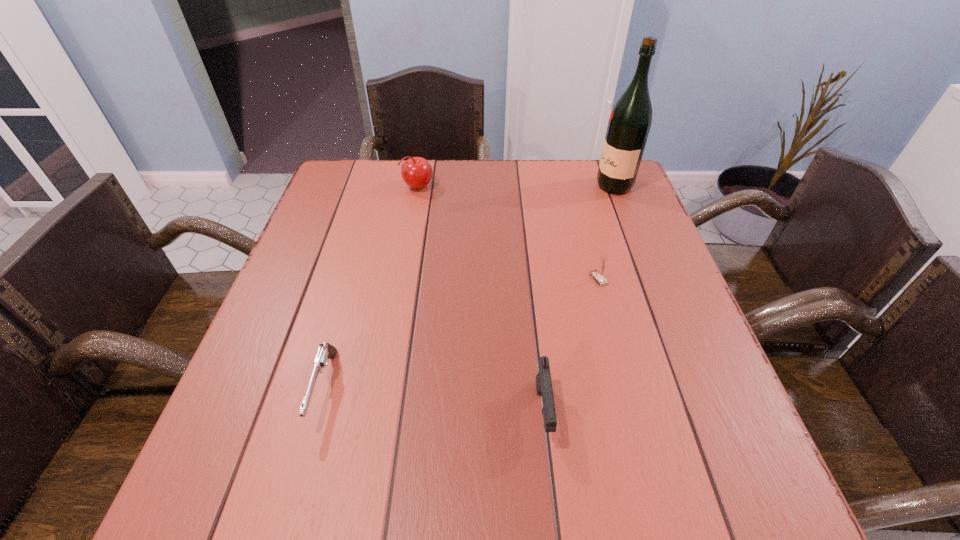
Locate an element on the screen. The width and height of the screenshot is (960, 540). matchbox that is positioned at the right edge is located at coordinates (599, 276).

Find the location of a particular element. The image size is (960, 540). object positioned at the far right corner is located at coordinates tap(629, 124).

You are a GUI agent. You are given a task and a screenshot of the screen. Output one action in this format:
    pyautogui.click(x=<x>, y=<y>)
    Task: Click on the vacant region at the far edge of the desktop
    The width and height of the screenshot is (960, 540).
    Given the screenshot: What is the action you would take?
    click(438, 166)

This screenshot has width=960, height=540. Find the location of `blank area at the near edge`. blank area at the near edge is located at coordinates (306, 486).

In the image, there is a desktop. Identify the location of vacant region at the left edge. The image size is (960, 540). (305, 298).

Locate an element on the screen. vacant space at the right edge is located at coordinates [649, 341].

This screenshot has height=540, width=960. In order to click on vacant space at the far left corner of the desktop in this screenshot , I will do `click(353, 178)`.

Where is `vacant area at the near left corner`? This screenshot has width=960, height=540. vacant area at the near left corner is located at coordinates (290, 505).

Identify the location of empty space that is in between the second object from left to right and the rightmost object. This screenshot has height=540, width=960. (516, 186).

Where is `unoccupied area between the second tallest object and the shortest object`? The width and height of the screenshot is (960, 540). unoccupied area between the second tallest object and the shortest object is located at coordinates (372, 288).